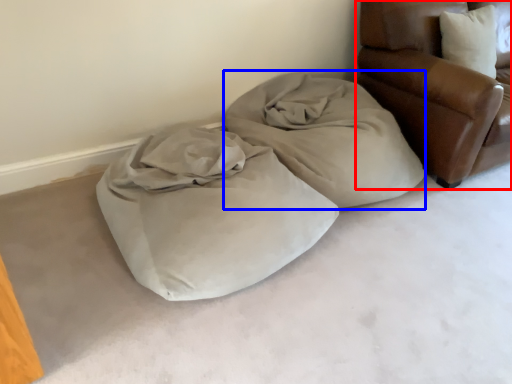
Question: Which object appears closest to the camera in this image, furniture (highlighted by a red box) or cloth (highlighted by a blue box)?

Choices:
 (A) furniture
 (B) cloth

Answer: (A)